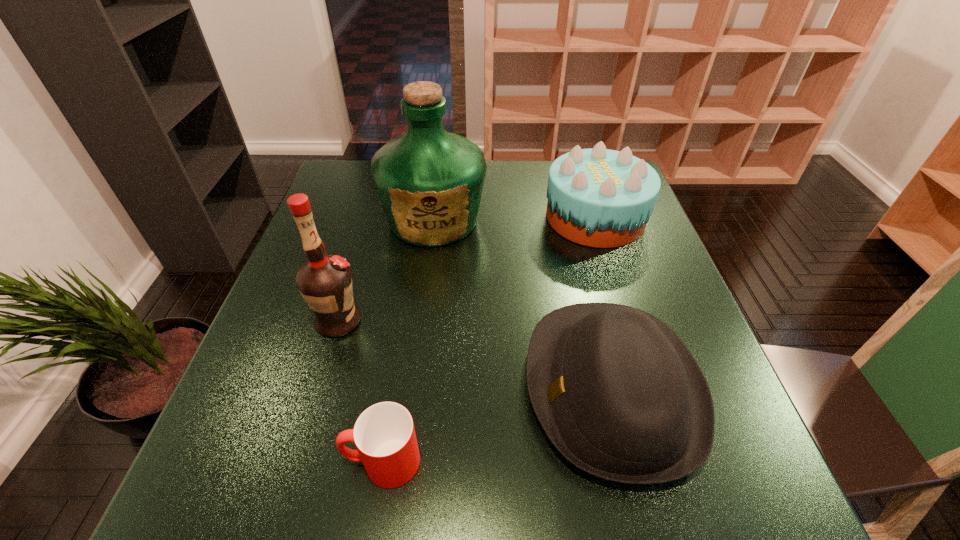
Identify the location of vacant space located on the front-facing side of the fedora. The height and width of the screenshot is (540, 960). (404, 388).

Identify the location of vacant space located 0.050m on the side of the cup with the handle. (315, 462).

Locate an element on the screen. The width and height of the screenshot is (960, 540). vacant region located 0.070m on the side of the cup with the handle is located at coordinates (302, 462).

Find the location of `free point located on the side of the cup with the handle`. free point located on the side of the cup with the handle is located at coordinates (237, 462).

In order to click on liquor at the far edge in this screenshot , I will do `click(429, 181)`.

I want to click on cake situated at the far edge, so click(x=601, y=198).

Locate an element on the screen. The image size is (960, 540). fedora present at the near edge is located at coordinates (618, 393).

Where is `cup present at the near edge`? The image size is (960, 540). cup present at the near edge is located at coordinates (384, 434).

Locate an element on the screen. The image size is (960, 540). object that is positioned at the left edge is located at coordinates (324, 281).

Locate an element on the screen. cake positioned at the right edge is located at coordinates (601, 198).